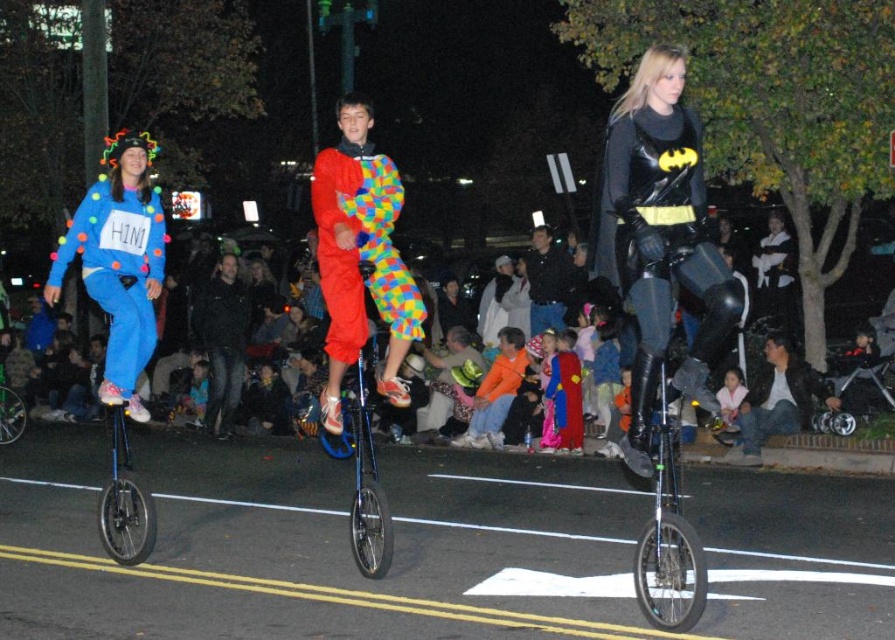
Between red polka dot jumpsuit at center and blue metallic unicycle at center, which one appears on the right side from the viewer's perspective?

Positioned to the right is red polka dot jumpsuit at center.

The width and height of the screenshot is (895, 640). Describe the element at coordinates (361, 248) in the screenshot. I see `red polka dot jumpsuit at center` at that location.

Identify the location of red polka dot jumpsuit at center. This screenshot has height=640, width=895. (361, 248).

Where is `red polka dot jumpsuit at center`? Image resolution: width=895 pixels, height=640 pixels. red polka dot jumpsuit at center is located at coordinates coord(361,248).

Does black leather jacket at center have a lesser width compared to dark blue shirt at center?

No.

Between black leather jacket at center and dark blue shirt at center, which one has less height?

dark blue shirt at center is shorter.

Identify the location of black leather jacket at center. (222, 340).

In order to click on black leather jacket at center in this screenshot , I will do `click(222, 340)`.

In the scene shown: Which of these two, matte blue jumpsuit at left or dark blue shirt at center, stands taller?

With more height is dark blue shirt at center.

Locate an element on the screen. This screenshot has width=895, height=640. matte blue jumpsuit at left is located at coordinates (118, 262).

Find the location of `matte blue jumpsuit at left`. matte blue jumpsuit at left is located at coordinates (118, 262).